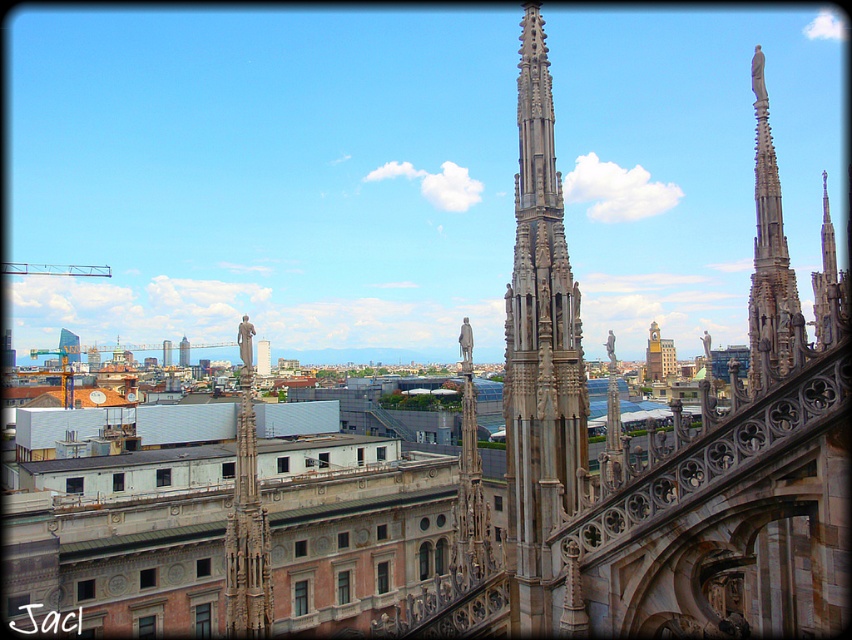
You are standing in front of the cathedral and looking towards the skyline. Which object is positioned to the right of the other between the stone spire at center and the white matte building at center?

The stone spire at center is positioned to the right of the white matte building at center.

You are standing in front of the cathedral and want to take a photo of the stone statue at center. Where should you position yourself to capture the statue in the center of your camera frame?

The stone statue at center is located at point (246, 518), so you should position yourself directly in front of that coordinate to center it in your camera frame.

What are the coordinates of the stone spire at center in the image?

The stone spire at center is located at coordinates point (539, 353).